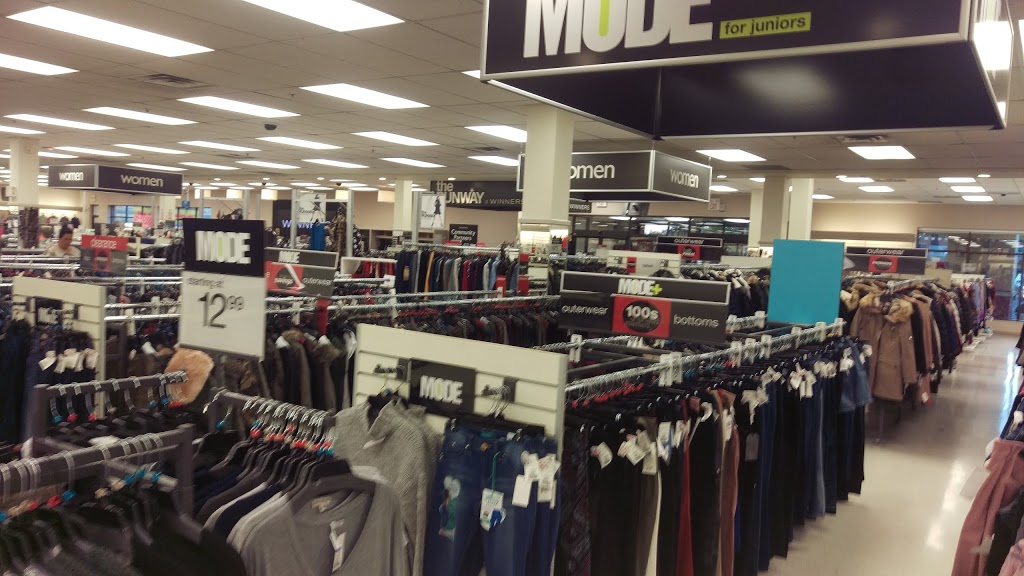
At what (x,y) coordinates should I click in order to perform the action: click on jacket rack. Please return your answer as a coordinate pair (x, y). Looking at the image, I should click on (895, 295).